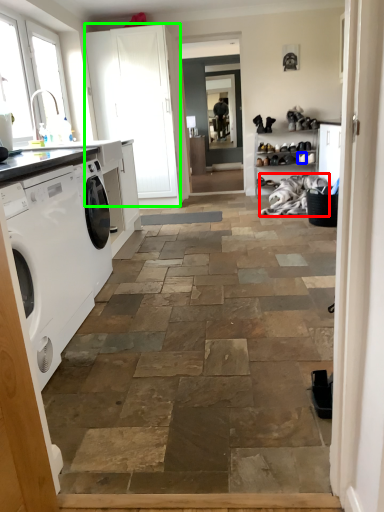
Question: Considering the real-world distances, which object is farthest from laundry (highlighted by a red box)? shoe (highlighted by a blue box) or screen door (highlighted by a green box)?

Choices:
 (A) shoe
 (B) screen door

Answer: (B)